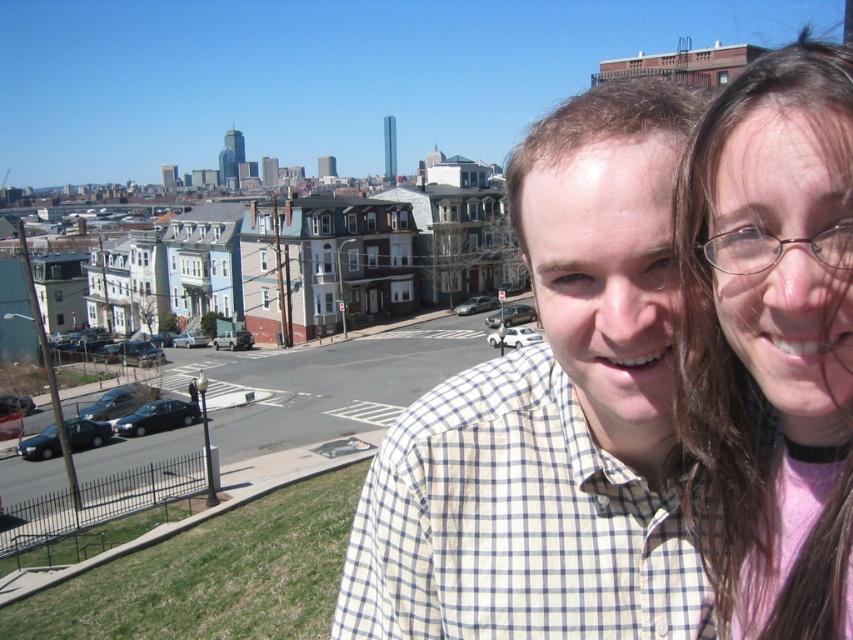
Question: Does white checkered shirt at center appear under pink fabric at upper right?

Choices:
 (A) yes
 (B) no

Answer: (A)

Question: Which point is closer to the camera?

Choices:
 (A) pink fabric at upper right
 (B) white checkered shirt at center

Answer: (A)

Question: Which of the following is the closest to the observer?

Choices:
 (A) white checkered shirt at center
 (B) pink fabric at upper right

Answer: (B)

Question: Is white checkered shirt at center above pink fabric at upper right?

Choices:
 (A) no
 (B) yes

Answer: (A)

Question: Which point appears closest to the camera in this image?

Choices:
 (A) (762, 195)
 (B) (666, 205)

Answer: (A)

Question: Does white checkered shirt at center appear on the left side of pink fabric at upper right?

Choices:
 (A) no
 (B) yes

Answer: (B)